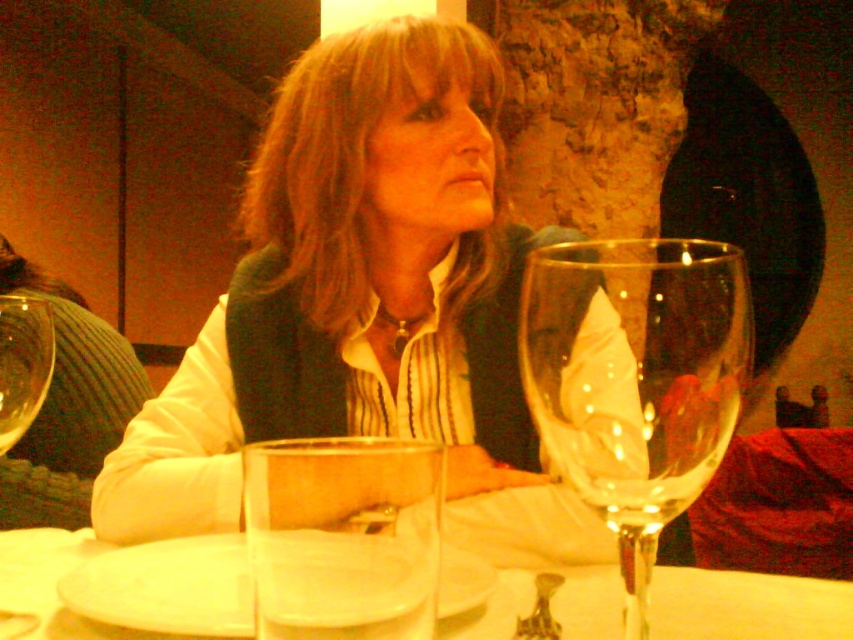
Question: Can you confirm if clear glass cup at center is positioned to the left of clear glass water at center?

Choices:
 (A) yes
 (B) no

Answer: (B)

Question: Observing the image, what is the correct spatial positioning of transparent glass wine glass at center in reference to transparent glass at left?

Choices:
 (A) left
 (B) right

Answer: (B)

Question: Which point is closer to the camera taking this photo?

Choices:
 (A) (695, 580)
 (B) (18, 330)

Answer: (B)

Question: Which point is closer to the camera?

Choices:
 (A) clear glass cup at center
 (B) transparent glass wine glass at center
 (C) clear glass water at center

Answer: (A)

Question: In this image, where is matte black vest at center located relative to transparent glass wine glass at center?

Choices:
 (A) left
 (B) right

Answer: (A)

Question: Among these objects, which one is farthest from the camera?

Choices:
 (A) clear glass cup at center
 (B) transparent glass wine glass at center

Answer: (B)